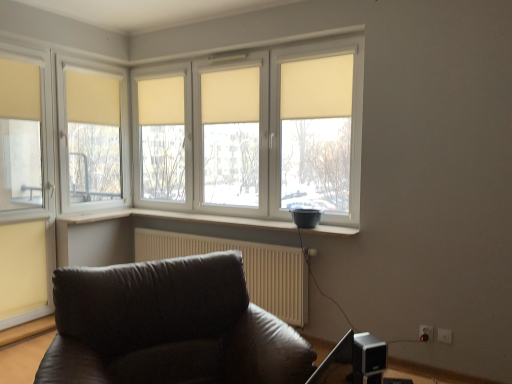
Measure the distance between matte yellow curtain at upper left, acting as the fifth curtain starting from the right, and camera.

matte yellow curtain at upper left, acting as the fifth curtain starting from the right, is 3.27 meters away from camera.

What is the approximate width of beige fabric curtain at center, which is counted as the second curtain, starting from the right?

The width of beige fabric curtain at center, which is counted as the second curtain, starting from the right, is 3.05 inches.

What do you see at coordinates (161, 101) in the screenshot? This screenshot has height=384, width=512. I see `beige fabric curtain at center, the 3th curtain when ordered from right to left` at bounding box center [161, 101].

Locate an element on the screen. white matte window at center is located at coordinates (254, 133).

In order to face matte white window at left, should I rotate leftwards or rightwards?

Rotate left and turn 28.836 degrees.

Describe the element at coordinates (244, 268) in the screenshot. This screenshot has width=512, height=384. I see `white textured radiator at lower center` at that location.

You are a GUI agent. You are given a task and a screenshot of the screen. Output one action in this format:
    pyautogui.click(x=<x>, y=<y>)
    Task: Click on the matte yellow curtain at upper left, which appears as the 1th curtain when viewed from the left
    The height and width of the screenshot is (384, 512).
    Given the screenshot: What is the action you would take?
    pyautogui.click(x=20, y=90)

From their relative heights in the image, would you say matte white window at left is taller or shorter than beige fabric curtain at upper left, the second curtain in the left-to-right sequence?

matte white window at left is taller than beige fabric curtain at upper left, the second curtain in the left-to-right sequence.

Is matte white window at left with beige fabric curtain at upper left, which is the 4th curtain from right to left?

No, matte white window at left is not next to beige fabric curtain at upper left, which is the 4th curtain from right to left.

In the scene shown: From the image's perspective, would you say matte white window at left is shown under beige fabric curtain at upper left, which is the 4th curtain from right to left?

Yes, from the image's perspective, matte white window at left is below beige fabric curtain at upper left, which is the 4th curtain from right to left.

Is matte white window at left outside of beige fabric curtain at upper left, the second curtain in the left-to-right sequence?

Yes, matte white window at left is located beyond the bounds of beige fabric curtain at upper left, the second curtain in the left-to-right sequence.

What's the angular difference between white textured radiator at lower center and matte white window at left's facing directions?

89.6 degrees.

In the scene shown: Considering the sizes of white textured radiator at lower center and matte white window at left in the image, is white textured radiator at lower center taller or shorter than matte white window at left?

In the image, white textured radiator at lower center appears to be shorter than matte white window at left.

From a real-world perspective, which object rests below the other?

white textured radiator at lower center.

Would you say white textured radiator at lower center is to the left or to the right of matte white window at left in the picture?

Clearly, white textured radiator at lower center is on the right of matte white window at left in the image.

From a real-world perspective, who is located higher, white plastic electric outlet at lower right, which ranks as the 1th electric outlet in left-to-right order, or white plastic electric outlet at lower right, the second electric outlet from the left?

white plastic electric outlet at lower right, the second electric outlet from the left, from a real-world perspective.

At what (x,y) coordinates should I click in order to perform the action: click on electric outlet that is above the white plastic electric outlet at lower right, which ranks as the 1th electric outlet in left-to-right order (from a real-world perspective). Please return your answer as a coordinate pair (x, y). The height and width of the screenshot is (384, 512). Looking at the image, I should click on (444, 335).

Considering the relative sizes of white plastic electric outlet at lower right, which ranks as the 1th electric outlet in left-to-right order, and white plastic electric outlet at lower right, placed as the 1th electric outlet when sorted from right to left, in the image provided, is white plastic electric outlet at lower right, which ranks as the 1th electric outlet in left-to-right order, taller than white plastic electric outlet at lower right, placed as the 1th electric outlet when sorted from right to left,?

Correct, white plastic electric outlet at lower right, which ranks as the 1th electric outlet in left-to-right order, is much taller as white plastic electric outlet at lower right, placed as the 1th electric outlet when sorted from right to left.

Who is smaller, white plastic electric outlet at lower right, which ranks as the 1th electric outlet in left-to-right order, or white plastic electric outlet at lower right, the second electric outlet from the left?

white plastic electric outlet at lower right, the second electric outlet from the left, is smaller.

Does white plastic window sill at center have a larger size compared to matte yellow curtain at upper left, which appears as the 1th curtain when viewed from the left?

Indeed, white plastic window sill at center has a larger size compared to matte yellow curtain at upper left, which appears as the 1th curtain when viewed from the left.

Which curtain is the 2nd one when counting from the back of the white plastic window sill at center? Please provide its 2D coordinates.

[(20, 90)]

Which is in front, point (314, 229) or point (36, 119)?

The point (314, 229) is closer to the camera.

Is white plastic window sill at center looking in the opposite direction of matte yellow curtain at upper left, acting as the fifth curtain starting from the right?

No.

Is matte yellow curtain at upper left, which appears as the 1th curtain when viewed from the left, inside or outside of white plastic window sill at center?

matte yellow curtain at upper left, which appears as the 1th curtain when viewed from the left, is outside white plastic window sill at center.

Is matte yellow curtain at upper left, acting as the fifth curtain starting from the right, at the right side of white plastic window sill at center?

In fact, matte yellow curtain at upper left, acting as the fifth curtain starting from the right, is to the left of white plastic window sill at center.

Considering the points (27, 100) and (229, 216), which point is behind, point (27, 100) or point (229, 216)?

Point (229, 216)

Considering the sizes of objects beige fabric curtain at upper right, which ranks as the 5th curtain in left-to-right order, and white plastic electric outlet at lower right, which ranks as the 1th electric outlet in left-to-right order, in the image provided, who is shorter, beige fabric curtain at upper right, which ranks as the 5th curtain in left-to-right order, or white plastic electric outlet at lower right, which ranks as the 1th electric outlet in left-to-right order,?

white plastic electric outlet at lower right, which ranks as the 1th electric outlet in left-to-right order, is shorter.

Based on the photo, are beige fabric curtain at upper right, which ranks as the 5th curtain in left-to-right order, and white plastic electric outlet at lower right, the second electric outlet when ordered from right to left, far apart?

Indeed, beige fabric curtain at upper right, which ranks as the 5th curtain in left-to-right order, is not near white plastic electric outlet at lower right, the second electric outlet when ordered from right to left.

Does beige fabric curtain at upper right, which ranks as the 5th curtain in left-to-right order, have a greater width compared to white plastic electric outlet at lower right, the second electric outlet when ordered from right to left?

Correct, the width of beige fabric curtain at upper right, which ranks as the 5th curtain in left-to-right order, exceeds that of white plastic electric outlet at lower right, the second electric outlet when ordered from right to left.

Is white matte window at center facing away from metallic silver speaker at lower right?

That's not correct — white matte window at center is not looking away from metallic silver speaker at lower right.

Visually, is white matte window at center positioned to the left or to the right of metallic silver speaker at lower right?

white matte window at center is positioned on metallic silver speaker at lower right's left side.

Is point (156, 84) positioned before point (360, 368)?

That is False.

From the image's perspective, which is above, white matte window at center or metallic silver speaker at lower right?

A: white matte window at center.

The height and width of the screenshot is (384, 512). In order to click on the 3rd curtain positioned above the matte white window at left (from a real-world perspective) in this screenshot , I will do `click(92, 99)`.

What are the coordinates of `window located in front of the white textured radiator at lower center` in the screenshot? It's located at (26, 185).

Which object lies nearer to the anchor point white plastic electric outlet at lower right, placed as the 1th electric outlet when sorted from right to left, white textured radiator at lower center or metallic silver speaker at lower right?

white textured radiator at lower center.

Which object lies nearer to the anchor point matte white window at left, white plastic electric outlet at lower right, the second electric outlet when ordered from right to left, or beige fabric curtain at upper right, which ranks as the 5th curtain in left-to-right order?

beige fabric curtain at upper right, which ranks as the 5th curtain in left-to-right order, lies closer to matte white window at left than the other object.

Looking at this image, from the image, which object appears to be nearer to white matte window at center, white plastic electric outlet at lower right, placed as the 1th electric outlet when sorted from right to left, or matte yellow curtain at upper left, acting as the fifth curtain starting from the right?

matte yellow curtain at upper left, acting as the fifth curtain starting from the right, is positioned closer to the anchor white matte window at center.

When comparing their distances from white textured radiator at lower center, does matte yellow curtain at upper left, which appears as the 1th curtain when viewed from the left, or beige fabric curtain at center, which is counted as the second curtain, starting from the right, seem closer?

Among the two, beige fabric curtain at center, which is counted as the second curtain, starting from the right, is located nearer to white textured radiator at lower center.

Which object lies nearer to the anchor point white textured radiator at lower center, matte white window at left or white plastic electric outlet at lower right, the second electric outlet from the left?

matte white window at left is closer to white textured radiator at lower center.

Based on their spatial positions, is beige fabric curtain at upper left, the second curtain in the left-to-right sequence, or beige fabric curtain at center, acting as the fourth curtain starting from the left, closer to metallic silver speaker at lower right?

beige fabric curtain at center, acting as the fourth curtain starting from the left.

Based on their spatial positions, is white plastic electric outlet at lower right, the second electric outlet when ordered from right to left, or beige fabric curtain at upper left, which is the 4th curtain from right to left, further from metallic silver speaker at lower right?

The object further to metallic silver speaker at lower right is beige fabric curtain at upper left, which is the 4th curtain from right to left.

When comparing their distances from white plastic electric outlet at lower right, placed as the 1th electric outlet when sorted from right to left, does beige fabric curtain at upper left, the second curtain in the left-to-right sequence, or matte white window at left seem closer?

Among the two, matte white window at left is located nearer to white plastic electric outlet at lower right, placed as the 1th electric outlet when sorted from right to left.

At what (x,y) coordinates should I click in order to perform the action: click on bay window between metallic silver speaker at lower right and beige fabric curtain at upper right, which appears as the 1th curtain when viewed from the right, in the front-back direction. Please return your answer as a coordinate pair (x, y). Looking at the image, I should click on (254, 133).

This screenshot has width=512, height=384. Find the location of `bay window situated between beige fabric curtain at upper left, the second curtain in the left-to-right sequence, and white plastic electric outlet at lower right, placed as the 1th electric outlet when sorted from right to left, from left to right`. bay window situated between beige fabric curtain at upper left, the second curtain in the left-to-right sequence, and white plastic electric outlet at lower right, placed as the 1th electric outlet when sorted from right to left, from left to right is located at coordinates (254, 133).

The height and width of the screenshot is (384, 512). What are the coordinates of `radiator situated between matte yellow curtain at upper left, acting as the fifth curtain starting from the right, and white matte window at center from left to right` in the screenshot? It's located at (244, 268).

The height and width of the screenshot is (384, 512). In order to click on window sill located between metallic silver speaker at lower right and beige fabric curtain at upper right, which appears as the 1th curtain when viewed from the right, in the depth direction in this screenshot , I will do `click(176, 218)`.